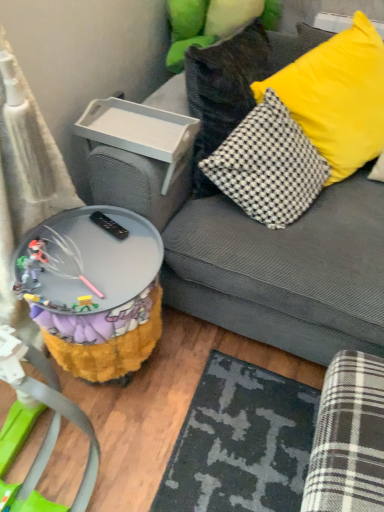
Question: Considering the relative positions of gray fabric couch at upper right and yellow fabric pillow at upper right in the image provided, is gray fabric couch at upper right to the left or to the right of yellow fabric pillow at upper right?

Choices:
 (A) left
 (B) right

Answer: (A)

Question: From the image's perspective, is gray fabric couch at upper right positioned above or below yellow fabric pillow at upper right?

Choices:
 (A) above
 (B) below

Answer: (B)

Question: Based on their relative distances, which object is nearer to the fuzzy fabric table at lower left?

Choices:
 (A) yellow fabric pillow at upper right
 (B) white plastic tray at upper left
 (C) gray fabric couch at upper right

Answer: (C)

Question: Considering the real-world distances, which object is farthest from the fuzzy fabric table at lower left?

Choices:
 (A) white plastic tray at upper left
 (B) gray fabric couch at upper right
 (C) yellow fabric pillow at upper right

Answer: (C)